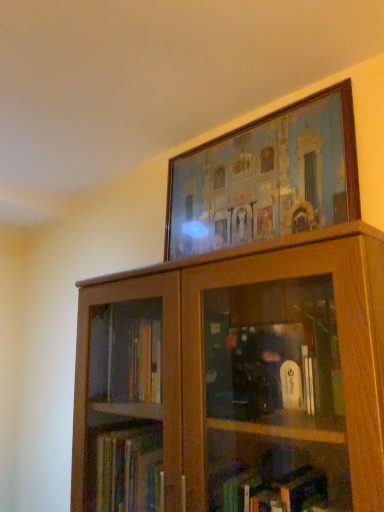
This screenshot has width=384, height=512. Describe the element at coordinates (266, 178) in the screenshot. I see `wooden picture frame at upper center` at that location.

Image resolution: width=384 pixels, height=512 pixels. Find the location of `wooden picture frame at upper center`. wooden picture frame at upper center is located at coordinates (266, 178).

Image resolution: width=384 pixels, height=512 pixels. What do you see at coordinates (235, 380) in the screenshot?
I see `wooden cabinet at upper center` at bounding box center [235, 380].

This screenshot has width=384, height=512. I want to click on wooden cabinet at upper center, so click(x=235, y=380).

Locate an element on the screen. wooden picture frame at upper center is located at coordinates (266, 178).

Between wooden picture frame at upper center and wooden cabinet at upper center, which one appears on the left side from the viewer's perspective?

wooden cabinet at upper center is more to the left.

Is wooden picture frame at upper center positioned before wooden cabinet at upper center?

No.

Is point (177, 246) farther from camera compared to point (257, 447)?

Yes, it is.

From the image's perspective, between wooden picture frame at upper center and wooden cabinet at upper center, who is located below?

wooden cabinet at upper center, from the image's perspective.

From a real-world perspective, between wooden picture frame at upper center and wooden cabinet at upper center, who is vertically higher?

wooden picture frame at upper center, from a real-world perspective.

Which of these two, wooden picture frame at upper center or wooden cabinet at upper center, is thinner?

wooden picture frame at upper center.

Considering the sizes of objects wooden picture frame at upper center and wooden cabinet at upper center in the image provided, who is taller, wooden picture frame at upper center or wooden cabinet at upper center?

wooden cabinet at upper center is taller.

Considering the relative sizes of wooden picture frame at upper center and wooden cabinet at upper center in the image provided, is wooden picture frame at upper center smaller than wooden cabinet at upper center?

Yes, wooden picture frame at upper center is smaller than wooden cabinet at upper center.

Is wooden picture frame at upper center completely or partially outside of wooden cabinet at upper center?

That's correct, wooden picture frame at upper center is outside of wooden cabinet at upper center.

Are wooden picture frame at upper center and wooden cabinet at upper center beside each other?

No, wooden picture frame at upper center is not beside wooden cabinet at upper center.

Is wooden picture frame at upper center positioned with its back to wooden cabinet at upper center?

No, wooden picture frame at upper center's orientation is not away from wooden cabinet at upper center.

What's the angular difference between wooden picture frame at upper center and wooden cabinet at upper center's facing directions?

The facing directions of wooden picture frame at upper center and wooden cabinet at upper center are 1.38 degrees apart.

Where is `bookcase that appears below the wooden picture frame at upper center (from a real-world perspective)`? Image resolution: width=384 pixels, height=512 pixels. bookcase that appears below the wooden picture frame at upper center (from a real-world perspective) is located at coordinates (235, 380).

Considering the relative positions of wooden cabinet at upper center and wooden picture frame at upper center in the image provided, is wooden cabinet at upper center to the left or to the right of wooden picture frame at upper center?

In the image, wooden cabinet at upper center appears on the left side of wooden picture frame at upper center.

Is wooden cabinet at upper center in front of wooden picture frame at upper center?

Yes, wooden cabinet at upper center is closer to the camera.

Is point (230, 329) more distant than point (297, 197)?

Yes, point (230, 329) is farther from viewer.

From the image's perspective, is wooden cabinet at upper center positioned above or below wooden picture frame at upper center?

From the image's perspective, wooden cabinet at upper center appears below wooden picture frame at upper center.

From a real-world perspective, which is physically below, wooden cabinet at upper center or wooden picture frame at upper center?

wooden cabinet at upper center.

Which of these two, wooden cabinet at upper center or wooden picture frame at upper center, is wider?

Wider between the two is wooden cabinet at upper center.

Consider the image. Which of these two, wooden cabinet at upper center or wooden picture frame at upper center, stands taller?

With more height is wooden cabinet at upper center.

Which of these two, wooden cabinet at upper center or wooden picture frame at upper center, is smaller?

With smaller size is wooden picture frame at upper center.

Would you say wooden cabinet at upper center is outside wooden picture frame at upper center?

That's correct, wooden cabinet at upper center is outside of wooden picture frame at upper center.

Are wooden cabinet at upper center and wooden picture frame at upper center far apart?

No, wooden cabinet at upper center is in close proximity to wooden picture frame at upper center.

Is wooden cabinet at upper center facing towards wooden picture frame at upper center?

No, wooden cabinet at upper center is not facing towards wooden picture frame at upper center.

How distant is wooden cabinet at upper center from wooden picture frame at upper center?

They are 15.03 inches apart.

This screenshot has width=384, height=512. Identify the location of picture frame that appears on the right of wooden cabinet at upper center. (266, 178).

Image resolution: width=384 pixels, height=512 pixels. I want to click on bookcase located in front of the wooden picture frame at upper center, so 235,380.

In order to click on picture frame that is on the right side of wooden cabinet at upper center in this screenshot , I will do [x=266, y=178].